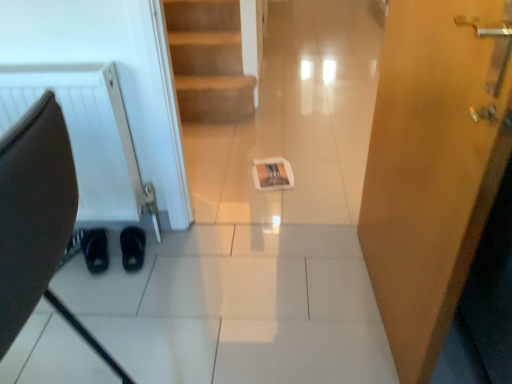
The width and height of the screenshot is (512, 384). I want to click on free spot to the left of wooden door at right, so click(278, 300).